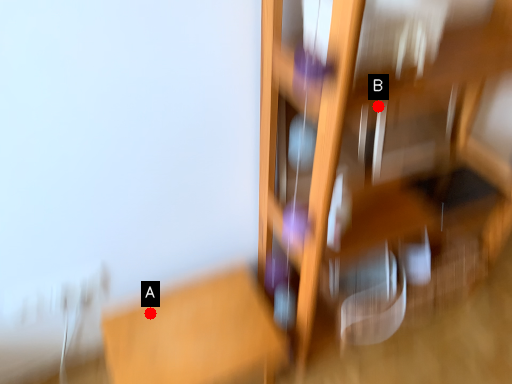
Question: Two points are circled on the image, labeled by A and B beside each circle. Which point is closer to the camera?

Choices:
 (A) A is closer
 (B) B is closer

Answer: (B)